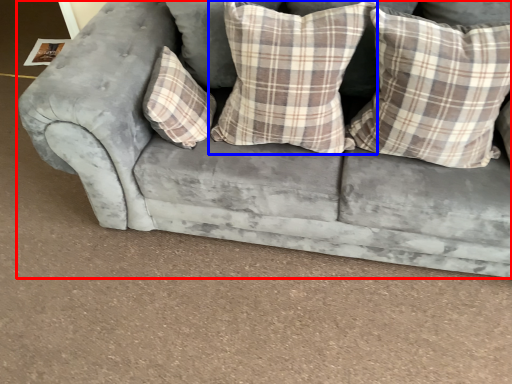
Question: Which object is further to the camera taking this photo, studio couch (highlighted by a red box) or pillow (highlighted by a blue box)?

Choices:
 (A) studio couch
 (B) pillow

Answer: (B)